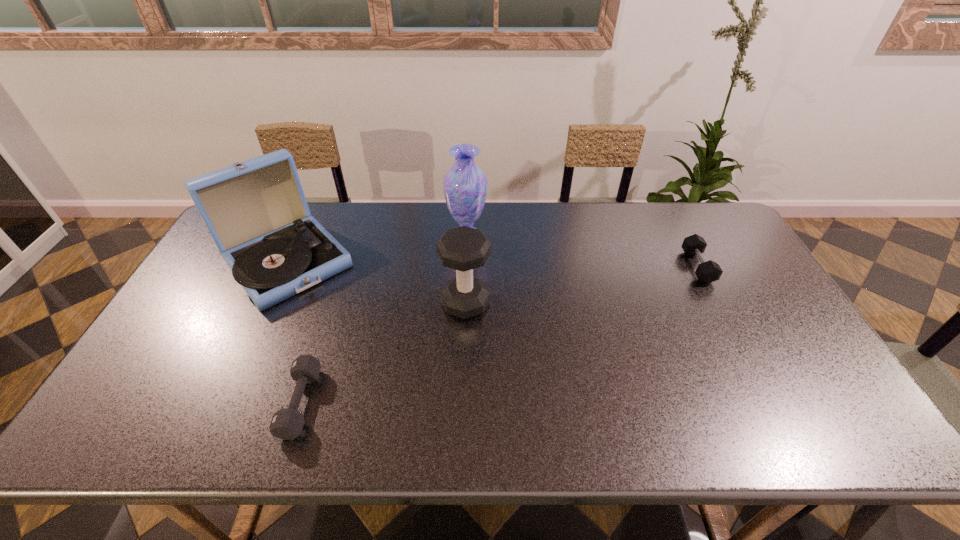
This screenshot has width=960, height=540. I want to click on vase, so click(465, 185).

At what (x,y) coordinates should I click in order to perform the action: click on phonograph record. Please return your answer as a coordinate pair (x, y). Looking at the image, I should click on (256, 212).

Where is `the second farthest dumbbell`? This screenshot has width=960, height=540. the second farthest dumbbell is located at coordinates (463, 248).

Image resolution: width=960 pixels, height=540 pixels. In order to click on the second dumbbell from right to left in this screenshot , I will do `click(463, 248)`.

Where is `the rightmost object`? the rightmost object is located at coordinates (707, 272).

Identify the location of the rightmost dumbbell. The width and height of the screenshot is (960, 540). (707, 272).

I want to click on the leftmost dumbbell, so click(287, 423).

Locate an element on the screen. the nearest dumbbell is located at coordinates (287, 423).

Find the location of `vacant space located 0.190m on the front of the vase`. vacant space located 0.190m on the front of the vase is located at coordinates (465, 292).

Where is `vacant region located 0.170m on the right of the phonograph record`? The image size is (960, 540). vacant region located 0.170m on the right of the phonograph record is located at coordinates (408, 261).